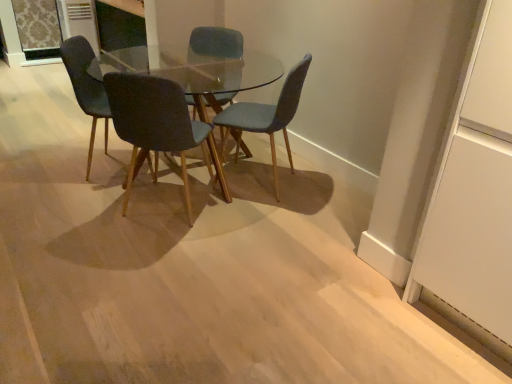
You are a GUI agent. You are given a task and a screenshot of the screen. Output one action in this format:
    pyautogui.click(x=<x>, y=<y>)
    Task: Click on the free space in front of transparent glass table at center
    Image resolution: width=512 pixels, height=384 pixels.
    Given the screenshot: What is the action you would take?
    pyautogui.click(x=162, y=260)